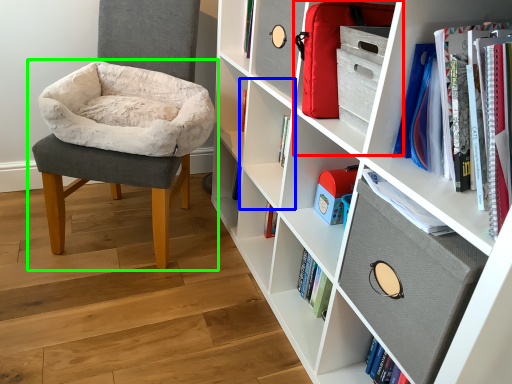
Question: Considering the real-world distances, which object is farthest from cabinet (highlighted by a red box)? shelf (highlighted by a blue box) or chair (highlighted by a green box)?

Choices:
 (A) shelf
 (B) chair

Answer: (B)